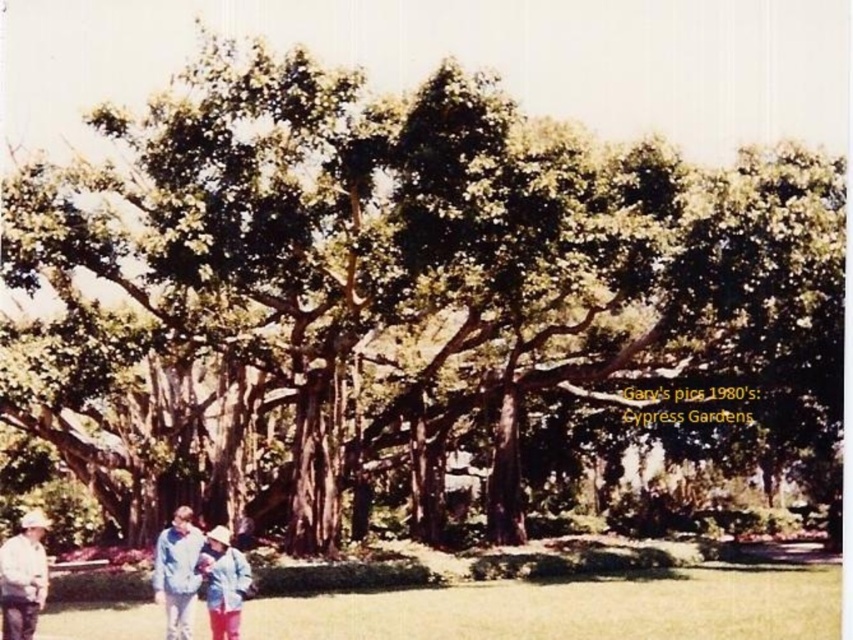
Is white cotton shirt at lower left thinner than light blue denim jacket at lower center?

No.

Is white cotton shirt at lower left to the left of light blue denim jacket at lower center from the viewer's perspective?

Correct, you'll find white cotton shirt at lower left to the left of light blue denim jacket at lower center.

The width and height of the screenshot is (853, 640). I want to click on white cotton shirt at lower left, so click(22, 577).

Which is more to the right, light blue denim jacket at lower left or light blue denim jacket at lower center?

light blue denim jacket at lower center

Identify the location of light blue denim jacket at lower left. Image resolution: width=853 pixels, height=640 pixels. (196, 576).

The width and height of the screenshot is (853, 640). What are the coordinates of `light blue denim jacket at lower left` in the screenshot? It's located at (196, 576).

Who is higher up, light blue denim jacket at lower left or white cotton shirt at lower left?

light blue denim jacket at lower left is higher up.

Is light blue denim jacket at lower left shorter than white cotton shirt at lower left?

Indeed, light blue denim jacket at lower left has a lesser height compared to white cotton shirt at lower left.

Which is in front, point (230, 628) or point (13, 554)?

Point (230, 628) is more forward.

Locate an element on the screen. The width and height of the screenshot is (853, 640). light blue denim jacket at lower left is located at coordinates (196, 576).